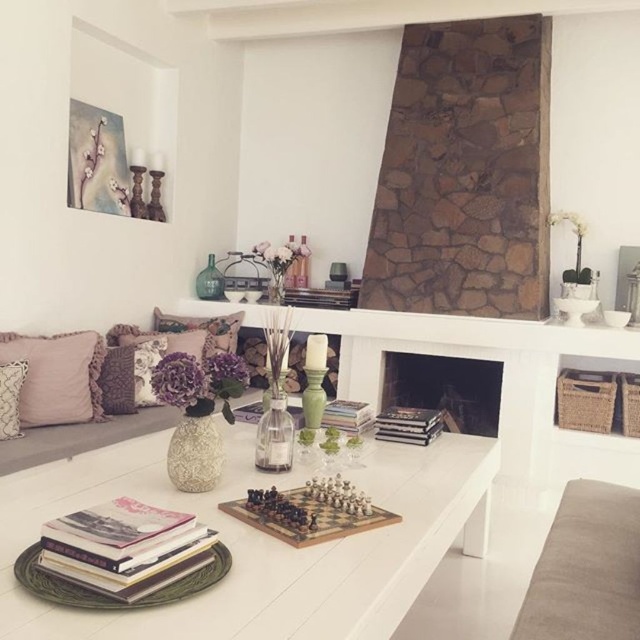
You are standing in the living room and want to place a new decorative item between the two points labeled point (468, 369) and point (349, 518). Which point should you move closer to the camera to ensure the item is placed in the foreground?

To place the decorative item in the foreground, you should move it closer to point (468, 369) because it is already further towards the camera compared to point (349, 518). This ensures the item remains visible in the front part of the scene.

You are standing in the living room and want to place a new decorative item on the closest object to you between the white glossy coffee table at center and the black stone fireplace at center. Which object should you choose?

The white glossy coffee table at center is closer to the viewer than the black stone fireplace at center, so you should place the decorative item on the white glossy coffee table at center.

You are planning to place a large rectangular plant stand in the living room. The stand is 1.2 meters long. You want to place it near the white glossy coffee table at center and the black stone fireplace at center. Which object should you place it next to so that it fits better?

The white glossy coffee table at center is larger in size than the black stone fireplace at center, so placing the plant stand next to the white glossy coffee table at center would provide more space for the stand to fit properly.